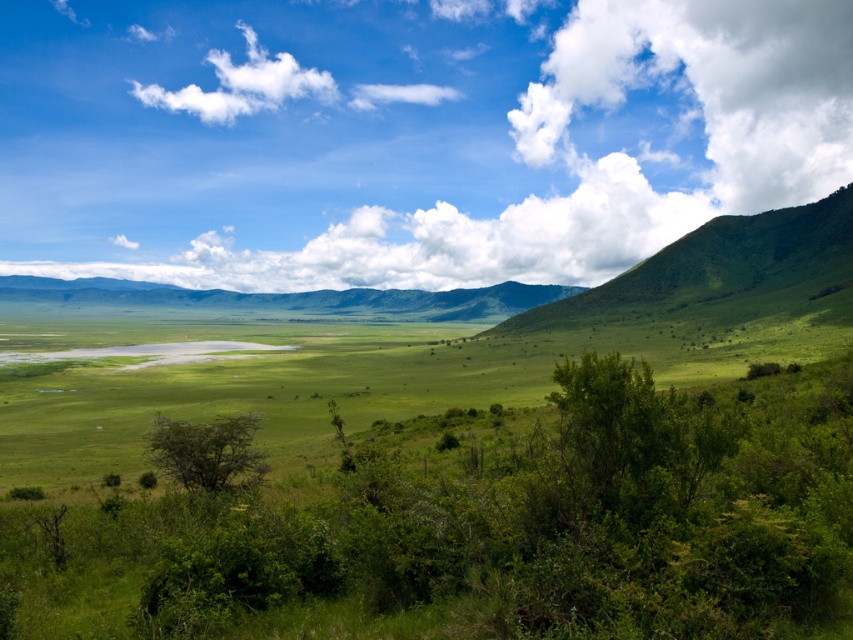
Which is behind, point (201, 204) or point (753, 184)?

The point (201, 204) is more distant.

How distant is white fluffy cloud at upper center from white fluffy cloud at upper right?

white fluffy cloud at upper center is 89.93 meters away from white fluffy cloud at upper right.

What do you see at coordinates (405, 134) in the screenshot? The image size is (853, 640). I see `white fluffy cloud at upper center` at bounding box center [405, 134].

Identify the location of white fluffy cloud at upper center. This screenshot has width=853, height=640. (405, 134).

Can you confirm if white fluffy cloud at upper center is bigger than green leafy shrubs at center?

Yes, white fluffy cloud at upper center is bigger than green leafy shrubs at center.

Measure the distance between white fluffy cloud at upper center and camera.

white fluffy cloud at upper center is 688.77 feet from camera.

Is point (560, 108) positioned before point (91, 614)?

No.

The height and width of the screenshot is (640, 853). Find the location of `white fluffy cloud at upper center`. white fluffy cloud at upper center is located at coordinates (405, 134).

From the picture: Which is more to the right, green leafy shrubs at center or white fluffy cloud at upper right?

From the viewer's perspective, white fluffy cloud at upper right appears more on the right side.

Find the location of a particular element. The image size is (853, 640). green leafy shrubs at center is located at coordinates (488, 525).

Where is `green leafy shrubs at center`? green leafy shrubs at center is located at coordinates (488, 525).